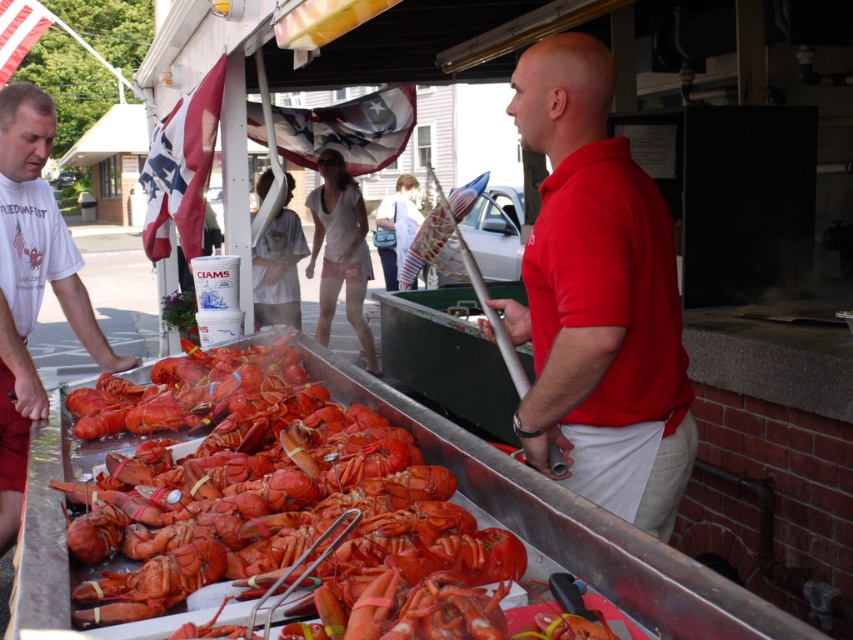
You are a photographer trying to capture a closeup of the shiny red lobster at center and the red cotton shirt at center in the same frame. Which object should you focus on first to ensure both are in focus?

The shiny red lobster at center is shorter than the red cotton shirt at center, so you should focus on the red cotton shirt at center first to ensure both are in focus.